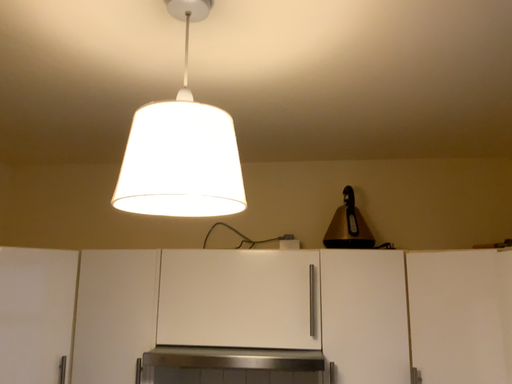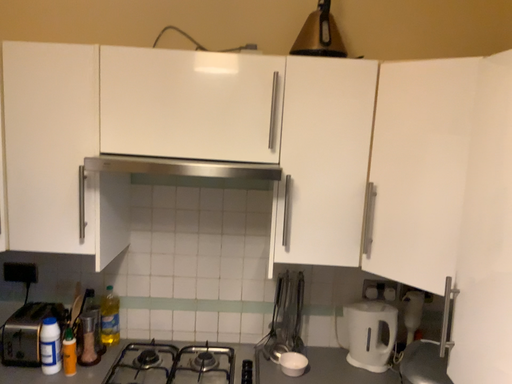
Question: How did the camera likely rotate when shooting the video?

Choices:
 (A) rotated upward
 (B) rotated downward

Answer: (B)